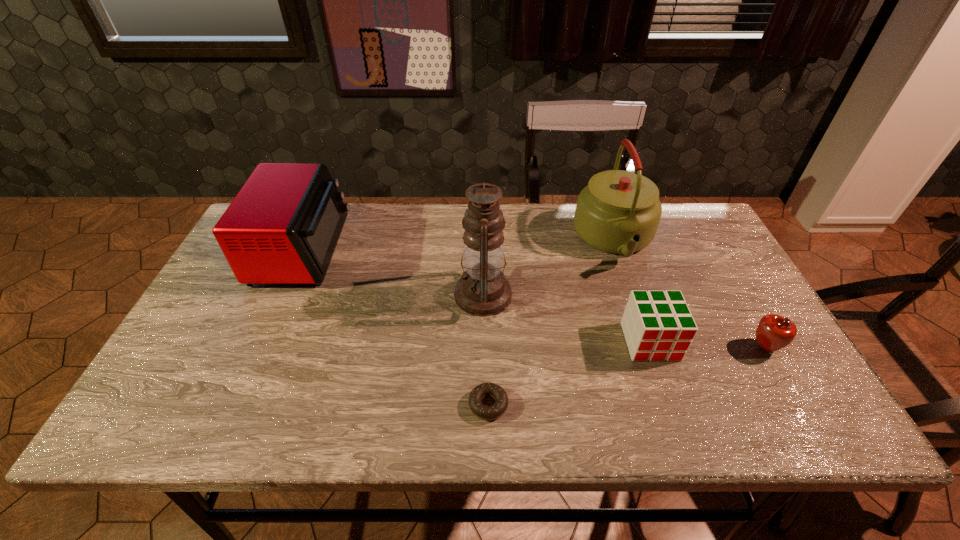
Find the location of a particular element. object present at the far left corner is located at coordinates click(283, 226).

In the image, there is a desktop. Identify the location of free space at the far edge. Image resolution: width=960 pixels, height=540 pixels. (454, 223).

This screenshot has width=960, height=540. In the image, there is a desktop. What are the coordinates of `vacant space at the near edge` in the screenshot? It's located at (273, 412).

Locate an element on the screen. This screenshot has width=960, height=540. vacant region at the left edge of the desktop is located at coordinates (194, 323).

In the image, there is a desktop. Where is `free region at the right edge`? free region at the right edge is located at coordinates (669, 254).

Where is `free space at the near left corner`? free space at the near left corner is located at coordinates (204, 428).

Image resolution: width=960 pixels, height=540 pixels. Find the location of `blank space at the far right corner of the desktop`. blank space at the far right corner of the desktop is located at coordinates (660, 232).

Where is `vacant area that lies between the apple and the fifth shortest object`? This screenshot has width=960, height=540. vacant area that lies between the apple and the fifth shortest object is located at coordinates (690, 294).

Where is `vacant region between the third shortest object and the nearest object`? The width and height of the screenshot is (960, 540). vacant region between the third shortest object and the nearest object is located at coordinates (569, 373).

Where is `vacant region between the nearest object and the third shortest object`? The image size is (960, 540). vacant region between the nearest object and the third shortest object is located at coordinates (569, 373).